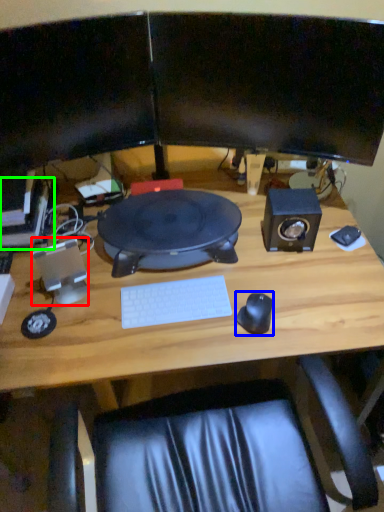
Question: Which is farther away from speaker (highlighted by a red box)? mouse (highlighted by a blue box) or computer (highlighted by a green box)?

Choices:
 (A) mouse
 (B) computer

Answer: (A)